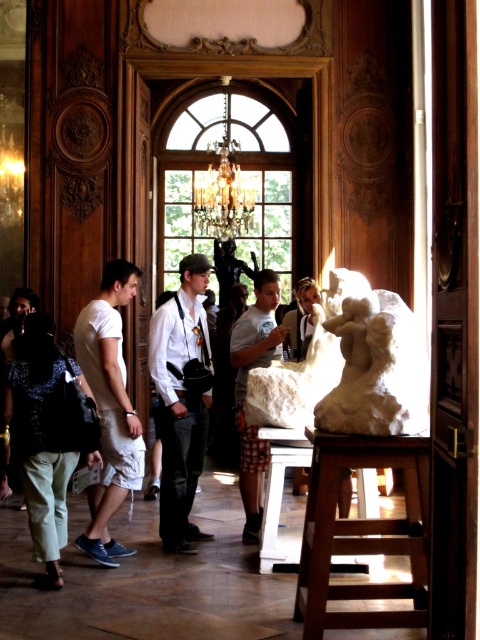
Question: Is denim jeans at center wider than light brown leather jacket at center?

Choices:
 (A) yes
 (B) no

Answer: (A)

Question: Considering the real-world distances, which object is closest to the denim jeans at center?

Choices:
 (A) white cotton shorts at left
 (B) light gray stone statue at center

Answer: (A)

Question: Which object appears closest to the camera in this image?

Choices:
 (A) light gray stone statue at center
 (B) wooden stool at lower right
 (C) denim jeans at center
 (D) white cotton shorts at left

Answer: (B)

Question: Considering the relative positions of light gray stone statue at center and light brown leather jacket at center in the image provided, where is light gray stone statue at center located with respect to light brown leather jacket at center?

Choices:
 (A) left
 (B) right

Answer: (A)

Question: Can you confirm if wooden stool at lower right is positioned below denim pants at lower left?

Choices:
 (A) no
 (B) yes

Answer: (B)

Question: Which of these objects is positioned closest to the light brown leather jacket at center?

Choices:
 (A) white marble statue at center
 (B) wooden stool at lower right
 (C) denim jeans at center

Answer: (C)